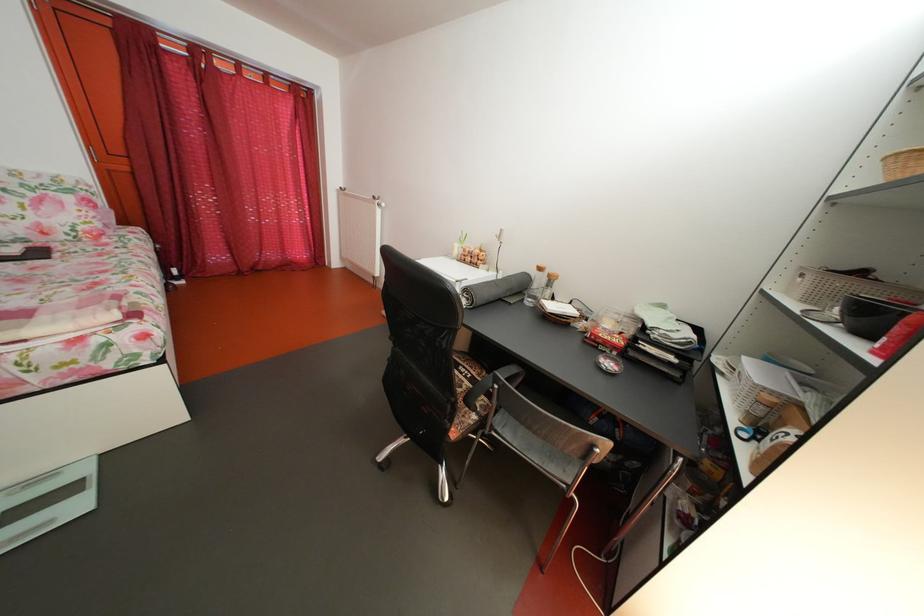
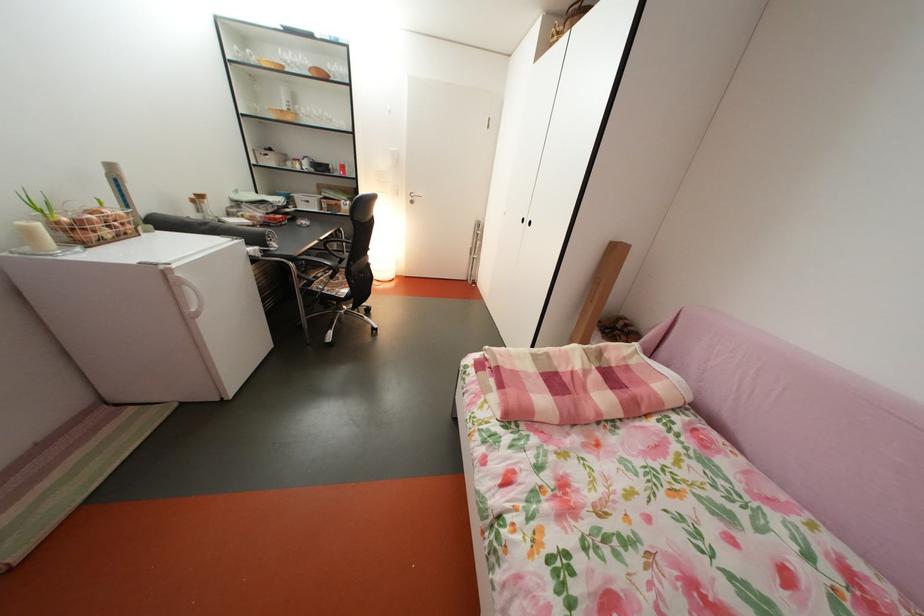
Locate, in the second image, the point that corresponds to pixel 466 253 in the first image.

(41, 238)